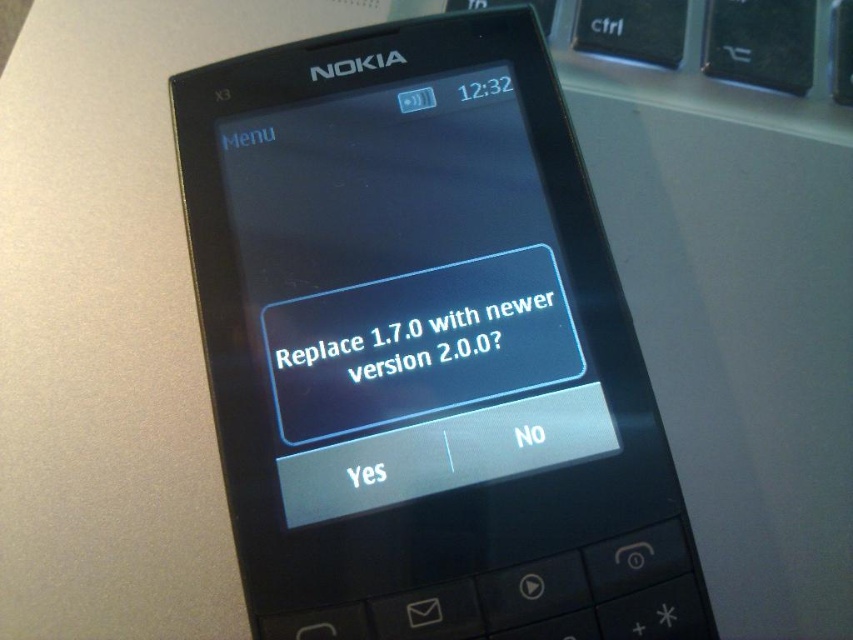
Is matte black screen at center taller than black matte text at center?

Yes, matte black screen at center is taller than black matte text at center.

Is the position of matte black screen at center less distant than that of black matte text at center?

That is True.

Who is more distant from viewer, [271,260] or [457,340]?

The point [271,260] is behind.

Identify the location of matte black screen at center. This screenshot has height=640, width=853. (405, 296).